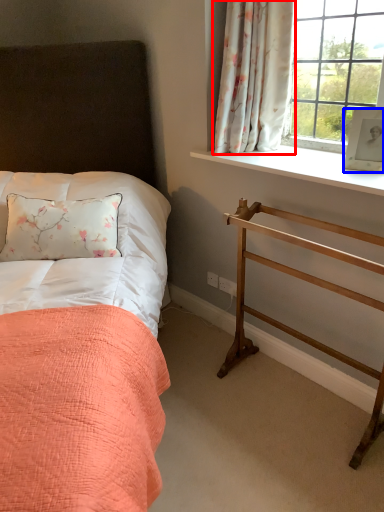
Question: Which object is closer to the camera taking this photo, curtain (highlighted by a red box) or picture frame (highlighted by a blue box)?

Choices:
 (A) curtain
 (B) picture frame

Answer: (B)